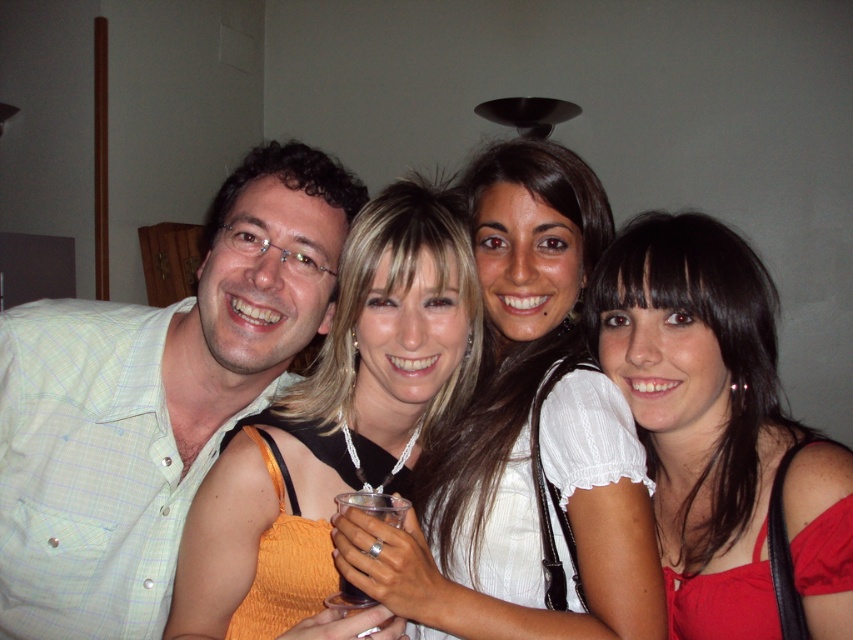
You are at a party and want to hand a small gift to the person wearing the white satin blouse at center without accidentally bumping into the dark translucent plastic cup at center. Which object should you reach toward first?

You should reach toward the white satin blouse at center first because it is closer to you than the dark translucent plastic cup at center.

You are at a party and need to place a dark translucent plastic cup at center on a table that can only hold items narrower than the white satin blouse at center. Can the cup fit on the table?

The white satin blouse at center is wider than the dark translucent plastic cup at center, so the cup can fit on the table since it is narrower than the blouse.

You are at a party and want to grab the dark translucent plastic cup at center without touching the orange satin dress at center. Is it possible to do so?

The orange satin dress at center is much taller than the dark translucent plastic cup at center, so you can bend down to pick up the dark translucent plastic cup at center without touching the orange satin dress at center.